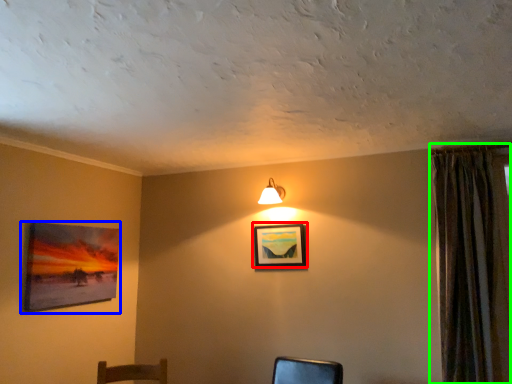
Question: Considering the real-world distances, which object is farthest from picture frame (highlighted by a red box)? picture frame (highlighted by a blue box) or curtain (highlighted by a green box)?

Choices:
 (A) picture frame
 (B) curtain

Answer: (A)